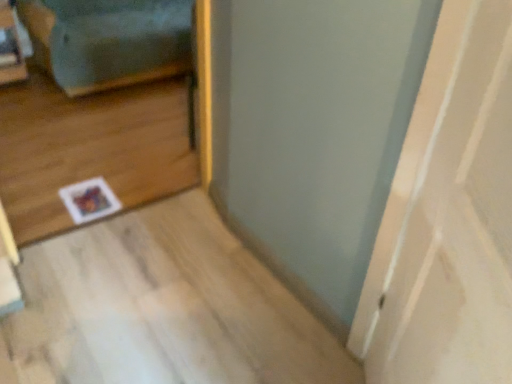
Question: In terms of size, does blue fabric couch at left appear bigger or smaller than white matte door at center?

Choices:
 (A) small
 (B) big

Answer: (B)

Question: Do you think blue fabric couch at left is within white matte door at center, or outside of it?

Choices:
 (A) outside
 (B) inside

Answer: (A)

Question: From the image's perspective, relative to white matte door at center, is blue fabric couch at left above or below?

Choices:
 (A) above
 (B) below

Answer: (A)

Question: Considering the positions of white matte door at center and blue fabric couch at left in the image, is white matte door at center bigger or smaller than blue fabric couch at left?

Choices:
 (A) big
 (B) small

Answer: (B)

Question: Considering the positions of white matte door at center and blue fabric couch at left in the image, is white matte door at center taller or shorter than blue fabric couch at left?

Choices:
 (A) short
 (B) tall

Answer: (B)

Question: Is white matte door at center situated inside blue fabric couch at left or outside?

Choices:
 (A) outside
 (B) inside

Answer: (A)

Question: Based on their positions, is white matte door at center located to the left or right of blue fabric couch at left?

Choices:
 (A) left
 (B) right

Answer: (B)